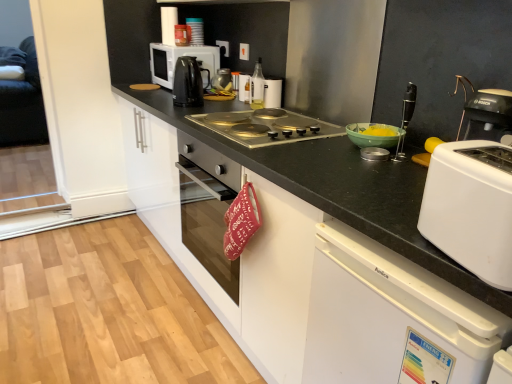
Question: Which direction should I rotate to look at metallic silver canister at upper center, which is counted as the 3th kitchen appliance, starting from the left?

Choices:
 (A) right
 (B) left

Answer: (B)

Question: Considering the relative sizes of metallic silver kettle at center, which is counted as the 5th kitchen appliance, starting from the left, and white plastic dishwasher at lower right, the first cabinetry positioned from the front, in the image provided, is metallic silver kettle at center, which is counted as the 5th kitchen appliance, starting from the left, smaller than white plastic dishwasher at lower right, the first cabinetry positioned from the front,?

Choices:
 (A) no
 (B) yes

Answer: (B)

Question: Considering the relative positions of metallic silver kettle at center, the 4th kitchen appliance when ordered from right to left, and white plastic dishwasher at lower right, the second cabinetry positioned from the back, in the image provided, is metallic silver kettle at center, the 4th kitchen appliance when ordered from right to left, behind white plastic dishwasher at lower right, the second cabinetry positioned from the back,?

Choices:
 (A) yes
 (B) no

Answer: (A)

Question: From a real-world perspective, is metallic silver kettle at center, which is counted as the 5th kitchen appliance, starting from the left, beneath white plastic dishwasher at lower right, the second cabinetry positioned from the back?

Choices:
 (A) no
 (B) yes

Answer: (A)

Question: Is metallic silver kettle at center, the 4th kitchen appliance when ordered from right to left, at the left side of white plastic dishwasher at lower right, the first cabinetry positioned from the front?

Choices:
 (A) yes
 (B) no

Answer: (A)

Question: Does metallic silver kettle at center, the 4th kitchen appliance when ordered from right to left, have a greater height compared to white plastic dishwasher at lower right, the second cabinetry positioned from the back?

Choices:
 (A) no
 (B) yes

Answer: (A)

Question: Does metallic silver kettle at center, which is counted as the 5th kitchen appliance, starting from the left, appear on the right side of white plastic dishwasher at lower right, the second cabinetry positioned from the back?

Choices:
 (A) no
 (B) yes

Answer: (A)

Question: Is matte plastic jar at upper center, which ranks as the second kitchen appliance in left-to-right order, thinner than white glossy microwave at upper left, the 8th kitchen appliance from the right?

Choices:
 (A) no
 (B) yes

Answer: (B)

Question: From a real-world perspective, does matte plastic jar at upper center, which ranks as the second kitchen appliance in left-to-right order, sit lower than white glossy microwave at upper left, the 8th kitchen appliance from the right?

Choices:
 (A) yes
 (B) no

Answer: (B)

Question: Are matte plastic jar at upper center, arranged as the seventh kitchen appliance when viewed from the right, and white glossy microwave at upper left, which appears as the 1th kitchen appliance when viewed from the left, located far from each other?

Choices:
 (A) no
 (B) yes

Answer: (A)

Question: From the image's perspective, does matte plastic jar at upper center, which ranks as the second kitchen appliance in left-to-right order, appear higher than white glossy microwave at upper left, which appears as the 1th kitchen appliance when viewed from the left?

Choices:
 (A) no
 (B) yes

Answer: (B)

Question: Considering the relative positions of matte plastic jar at upper center, arranged as the seventh kitchen appliance when viewed from the right, and white glossy microwave at upper left, which appears as the 1th kitchen appliance when viewed from the left, in the image provided, is matte plastic jar at upper center, arranged as the seventh kitchen appliance when viewed from the right, to the right of white glossy microwave at upper left, which appears as the 1th kitchen appliance when viewed from the left, from the viewer's perspective?

Choices:
 (A) no
 (B) yes

Answer: (B)

Question: Is matte plastic jar at upper center, which ranks as the second kitchen appliance in left-to-right order, positioned before white glossy microwave at upper left, which appears as the 1th kitchen appliance when viewed from the left?

Choices:
 (A) no
 (B) yes

Answer: (A)

Question: From a real-world perspective, does clear glass bottle at center, the seventh kitchen appliance from the left, sit lower than metallic silver canister at upper center, which is counted as the 3th kitchen appliance, starting from the left?

Choices:
 (A) no
 (B) yes

Answer: (B)